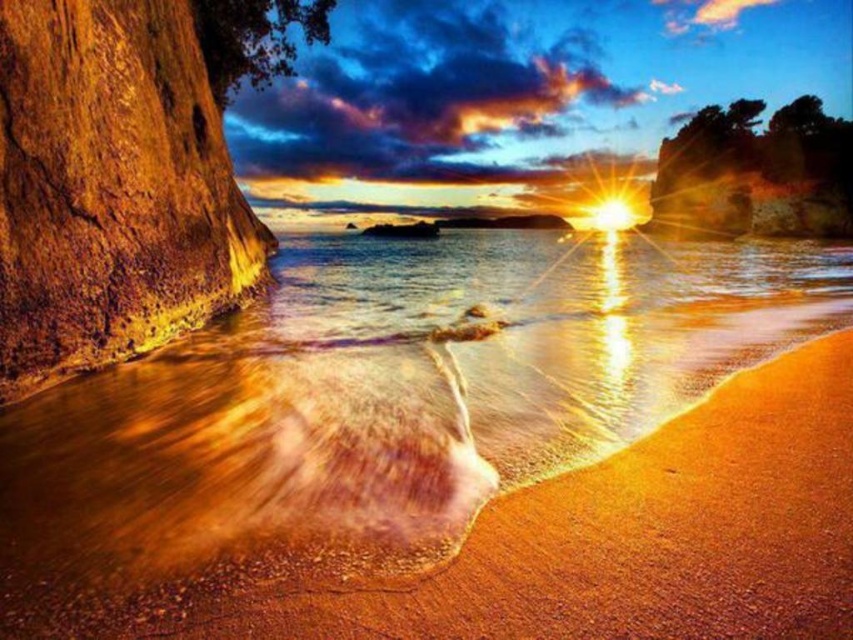
Is golden sand at lower center closer to camera compared to rusty wood rock at left?

Yes, golden sand at lower center is in front of rusty wood rock at left.

Is golden sand at lower center thinner than rusty wood rock at left?

In fact, golden sand at lower center might be wider than rusty wood rock at left.

Between point (666, 308) and point (33, 234), which one is positioned in front?

Point (33, 234)

At what (x,y) coordinates should I click in order to perform the action: click on golden sand at lower center. Please return your answer as a coordinate pair (x, y). Looking at the image, I should click on (369, 413).